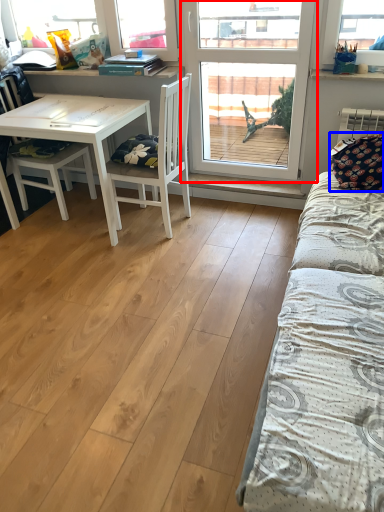
Question: Which object is further to the camera taking this photo, window (highlighted by a red box) or pillow (highlighted by a blue box)?

Choices:
 (A) window
 (B) pillow

Answer: (A)